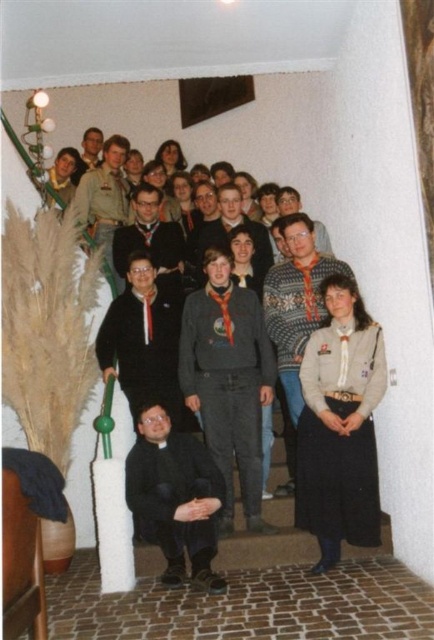
Measure the distance between gray wool sweater at center and matte khaki shirt at upper left.

A distance of 9.06 feet exists between gray wool sweater at center and matte khaki shirt at upper left.

Find the location of a particular element. The height and width of the screenshot is (640, 434). gray wool sweater at center is located at coordinates (234, 227).

Does white cotton shirt at center appear over knitted sweater at center?

Actually, white cotton shirt at center is below knitted sweater at center.

Can you confirm if white cotton shirt at center is wider than knitted sweater at center?

Incorrect, white cotton shirt at center's width does not surpass knitted sweater at center's.

Image resolution: width=434 pixels, height=640 pixels. What do you see at coordinates (339, 426) in the screenshot?
I see `white cotton shirt at center` at bounding box center [339, 426].

The height and width of the screenshot is (640, 434). Find the location of `white cotton shirt at center`. white cotton shirt at center is located at coordinates (339, 426).

Measure the distance between camouflage uniform at center and matte khaki shirt at upper left.

camouflage uniform at center is 1.20 meters away from matte khaki shirt at upper left.

Which of these two, camouflage uniform at center or matte khaki shirt at upper left, stands shorter?

With less height is matte khaki shirt at upper left.

Find the location of `camouflage uniform at center`. camouflage uniform at center is located at coordinates (105, 198).